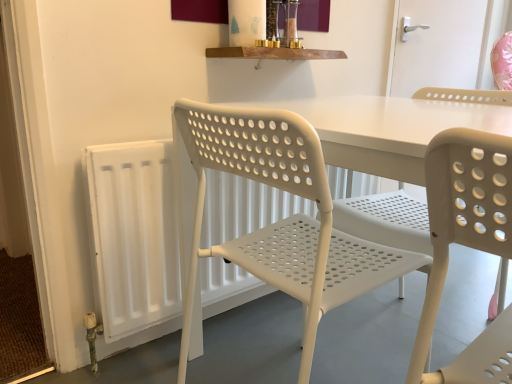
Where is `white plastic door handle at upper right`? The image size is (512, 384). white plastic door handle at upper right is located at coordinates (438, 45).

Image resolution: width=512 pixels, height=384 pixels. What do you see at coordinates (284, 219) in the screenshot?
I see `white plastic chair at left` at bounding box center [284, 219].

This screenshot has height=384, width=512. In order to click on white plastic door handle at upper right in this screenshot , I will do `click(438, 45)`.

From a real-world perspective, is white plastic door handle at upper right on top of white plastic radiator at left?

Yes, from a real-world perspective, white plastic door handle at upper right is over white plastic radiator at left

How many degrees apart are the facing directions of white plastic door handle at upper right and white plastic radiator at left?

0.518 degrees separate the facing orientations of white plastic door handle at upper right and white plastic radiator at left.

Is point (395, 90) closer or farther from the camera than point (229, 294)?

Clearly, point (395, 90) is more distant from the camera than point (229, 294).

Which is in front, white plastic door handle at upper right or white plastic radiator at left?

white plastic radiator at left is more forward.

Between white plastic chair at left and white plastic radiator at left, which one appears on the left side from the viewer's perspective?

white plastic radiator at left.

Consider the image. Looking at their sizes, would you say white plastic chair at left is wider or thinner than white plastic radiator at left?

In the image, white plastic chair at left appears to be wider than white plastic radiator at left.

From the picture: Is white plastic chair at left positioned before white plastic radiator at left?

Yes.

Is white plastic chair at left outside of white plastic radiator at left?

Absolutely, white plastic chair at left is external to white plastic radiator at left.

Which is correct: white plastic radiator at left is inside white plastic door handle at upper right, or outside of it?

white plastic radiator at left is located beyond the bounds of white plastic door handle at upper right.

From a real-world perspective, between white plastic radiator at left and white plastic door handle at upper right, who is vertically lower?

white plastic radiator at left is physically lower.

How much distance is there between white plastic radiator at left and white plastic door handle at upper right?

white plastic radiator at left is 1.20 meters away from white plastic door handle at upper right.

Which object is thinner, white plastic radiator at left or white plastic door handle at upper right?

Thinner between the two is white plastic door handle at upper right.

This screenshot has width=512, height=384. Identify the location of screen door lying behind the white plastic chair at left. (438, 45).

From a real-world perspective, is white plastic chair at left below white plastic door handle at upper right?

Yes, from a real-world perspective, white plastic chair at left is beneath white plastic door handle at upper right.

Is white plastic chair at left touching white plastic door handle at upper right?

No.

From the image's perspective, relative to white plastic door handle at upper right, is white plastic chair at left above or below?

white plastic chair at left is below white plastic door handle at upper right.

Is white plastic door handle at upper right oriented towards white plastic chair at left?

No, white plastic door handle at upper right does not turn towards white plastic chair at left.

From a real-world perspective, between white plastic door handle at upper right and white plastic chair at left, who is vertically lower?

white plastic chair at left, from a real-world perspective.

At what (x,y) coordinates should I click in order to perform the action: click on chair below the white plastic door handle at upper right (from a real-world perspective). Please return your answer as a coordinate pair (x, y). The width and height of the screenshot is (512, 384). Looking at the image, I should click on (284, 219).

Does white plastic door handle at upper right come in front of white plastic chair at left?

No.

Considering the sizes of objects white plastic radiator at left and white plastic chair at left in the image provided, who is wider, white plastic radiator at left or white plastic chair at left?

Wider between the two is white plastic chair at left.

Is white plastic radiator at left not close to white plastic chair at left?

Actually, white plastic radiator at left and white plastic chair at left are a little close together.

From a real-world perspective, is white plastic radiator at left below white plastic chair at left?

Yes, from a real-world perspective, white plastic radiator at left is under white plastic chair at left.

How much distance is there between white plastic radiator at left and white plastic chair at left?

white plastic radiator at left is 12.99 inches away from white plastic chair at left.

Image resolution: width=512 pixels, height=384 pixels. In the image, there is a white plastic door handle at upper right. What are the coordinates of `radiator below it (from the image's perspective)` in the screenshot? It's located at (133, 235).

Locate an element on the screen. chair located in front of the white plastic radiator at left is located at coordinates (284, 219).

Based on their spatial positions, is white plastic chair at left or white plastic door handle at upper right closer to white plastic radiator at left?

white plastic chair at left lies closer to white plastic radiator at left than the other object.

Considering their positions, is white plastic door handle at upper right positioned further to white plastic radiator at left than white plastic chair at left?

white plastic door handle at upper right is further to white plastic radiator at left.

Which object lies nearer to the anchor point white plastic door handle at upper right, white plastic radiator at left or white plastic chair at left?

white plastic radiator at left.

Based on their spatial positions, is white plastic chair at left or white plastic radiator at left further from white plastic door handle at upper right?

white plastic chair at left is positioned further to the anchor white plastic door handle at upper right.

Looking at the image, which one is located closer to white plastic chair at left, white plastic radiator at left or white plastic door handle at upper right?

Among the two, white plastic radiator at left is located nearer to white plastic chair at left.

Looking at the image, which one is located closer to white plastic chair at left, white plastic door handle at upper right or white plastic radiator at left?

Among the two, white plastic radiator at left is located nearer to white plastic chair at left.

Where is `radiator between white plastic chair at left and white plastic door handle at upper right from front to back`? The height and width of the screenshot is (384, 512). radiator between white plastic chair at left and white plastic door handle at upper right from front to back is located at coordinates (133, 235).